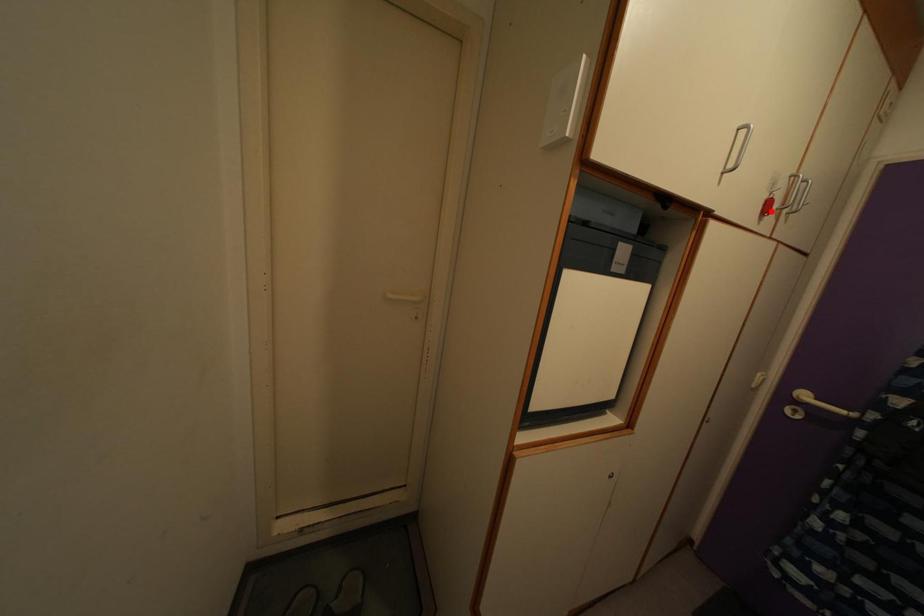
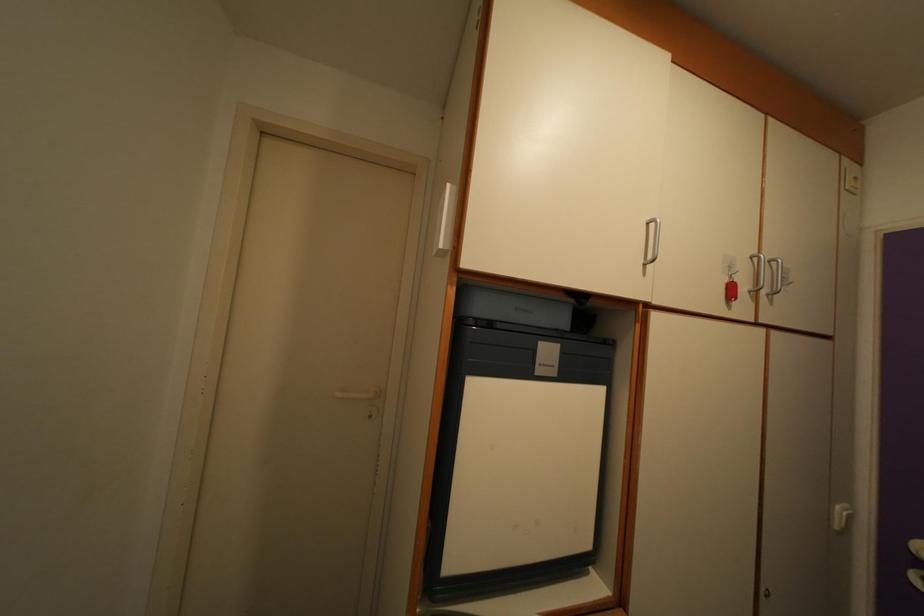
In the second image, find the point that corresponds to the highlighted location in the first image.

(735, 294)